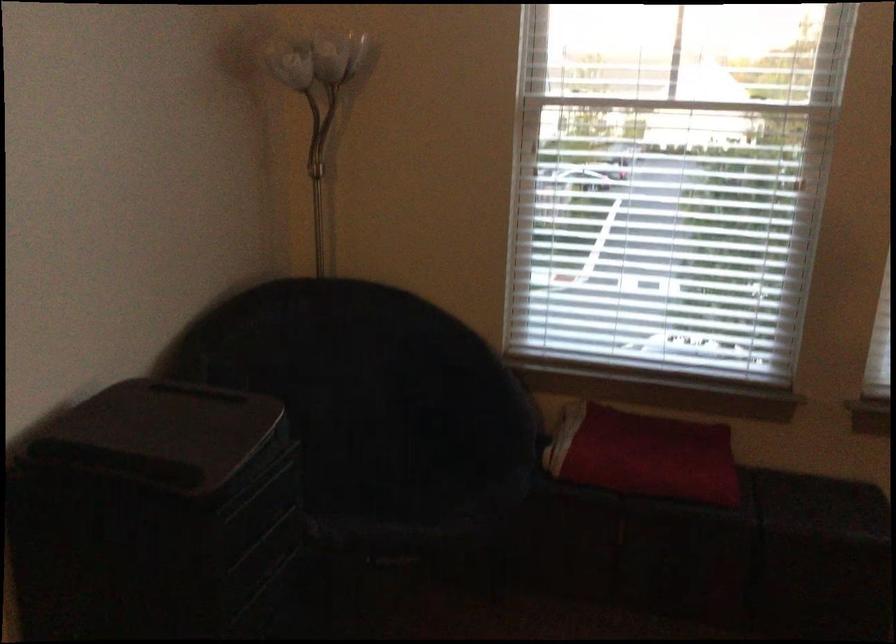
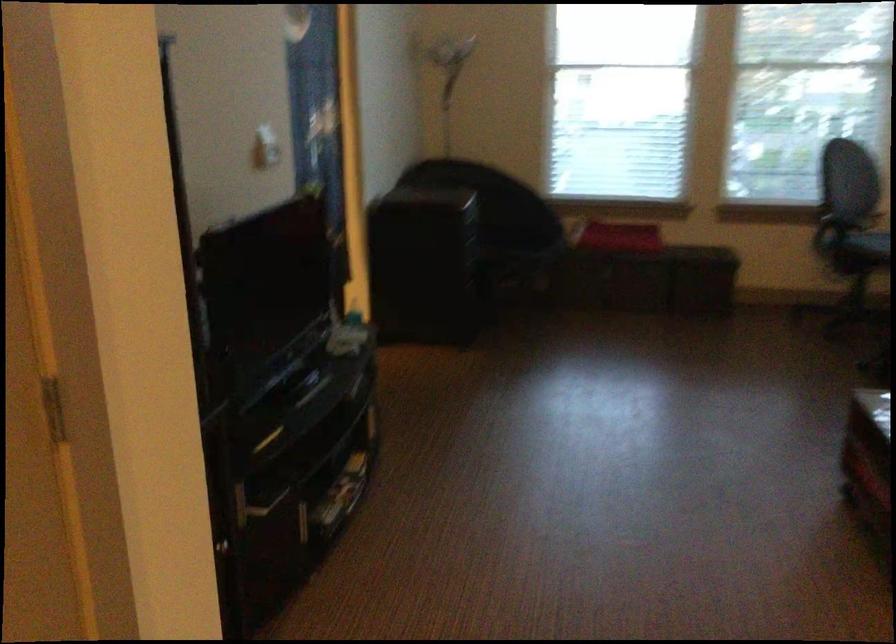
Question: The images are taken continuously from a first-person perspective. In which direction are you moving?

Choices:
 (A) Left
 (B) Right
 (C) Forward
 (D) Backward

Answer: (D)